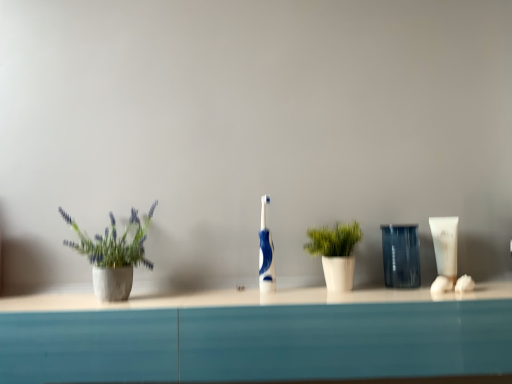
Question: Is blue glossy toothbrush at center wider than white matte plant pot at center, which ranks as the first houseplant in right-to-left order?

Choices:
 (A) no
 (B) yes

Answer: (A)

Question: Is blue glossy toothbrush at center in contact with white matte plant pot at center, the second houseplant when ordered from left to right?

Choices:
 (A) no
 (B) yes

Answer: (A)

Question: From the image's perspective, is blue glossy toothbrush at center below white matte plant pot at center, which ranks as the first houseplant in right-to-left order?

Choices:
 (A) yes
 (B) no

Answer: (B)

Question: Considering the relative sizes of blue glossy toothbrush at center and white matte plant pot at center, which ranks as the first houseplant in right-to-left order, in the image provided, is blue glossy toothbrush at center shorter than white matte plant pot at center, which ranks as the first houseplant in right-to-left order,?

Choices:
 (A) no
 (B) yes

Answer: (A)

Question: Is blue glossy toothbrush at center outside white matte plant pot at center, which ranks as the first houseplant in right-to-left order?

Choices:
 (A) no
 (B) yes

Answer: (B)

Question: From a real-world perspective, is white matte plant pot at center, the second houseplant when ordered from left to right, positioned above or below blue glossy toothbrush at center?

Choices:
 (A) above
 (B) below

Answer: (B)

Question: Is point (337, 263) closer or farther from the camera than point (262, 266)?

Choices:
 (A) closer
 (B) farther

Answer: (A)

Question: Is white matte plant pot at center, which ranks as the first houseplant in right-to-left order, bigger or smaller than blue glossy toothbrush at center?

Choices:
 (A) big
 (B) small

Answer: (A)

Question: From the image's perspective, is white matte plant pot at center, the second houseplant when ordered from left to right, located above or below blue glossy toothbrush at center?

Choices:
 (A) below
 (B) above

Answer: (A)

Question: From a real-world perspective, relative to white matte plant pot at center, which ranks as the first houseplant in right-to-left order, is matte concrete pot at left, which is the first houseplant in left-to-right order, vertically above or below?

Choices:
 (A) above
 (B) below

Answer: (A)

Question: Visually, is matte concrete pot at left, which is the first houseplant in left-to-right order, positioned to the left or to the right of white matte plant pot at center, which ranks as the first houseplant in right-to-left order?

Choices:
 (A) right
 (B) left

Answer: (B)

Question: Is matte concrete pot at left, which is the first houseplant in left-to-right order, inside the boundaries of white matte plant pot at center, the second houseplant when ordered from left to right, or outside?

Choices:
 (A) inside
 (B) outside

Answer: (B)

Question: In the image, is matte concrete pot at left, the 2th houseplant when ordered from right to left, positioned in front of or behind white matte plant pot at center, which ranks as the first houseplant in right-to-left order?

Choices:
 (A) front
 (B) behind

Answer: (A)

Question: From a real-world perspective, is transparent plastic cup at center positioned above or below blue glossy toothbrush at center?

Choices:
 (A) above
 (B) below

Answer: (B)

Question: Considering the positions of transparent plastic cup at center and blue glossy toothbrush at center in the image, is transparent plastic cup at center bigger or smaller than blue glossy toothbrush at center?

Choices:
 (A) big
 (B) small

Answer: (A)